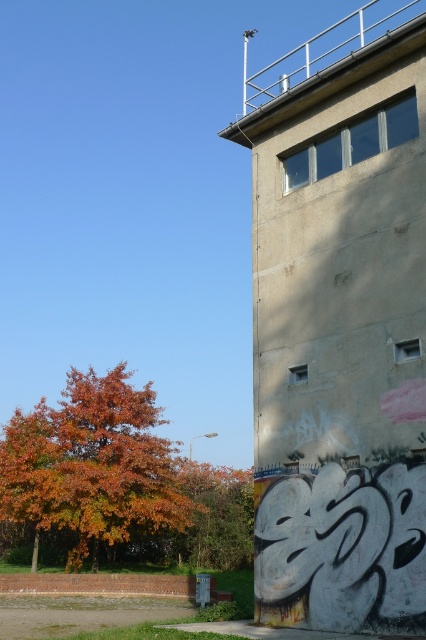
Does orange leafy tree at lower left appear under orange leafy tree at left?

Incorrect, orange leafy tree at lower left is not positioned below orange leafy tree at left.

How much distance is there between orange leafy tree at lower left and orange leafy tree at left?

The distance of orange leafy tree at lower left from orange leafy tree at left is 4.00 meters.

Where is `orange leafy tree at lower left`? orange leafy tree at lower left is located at coordinates (92, 465).